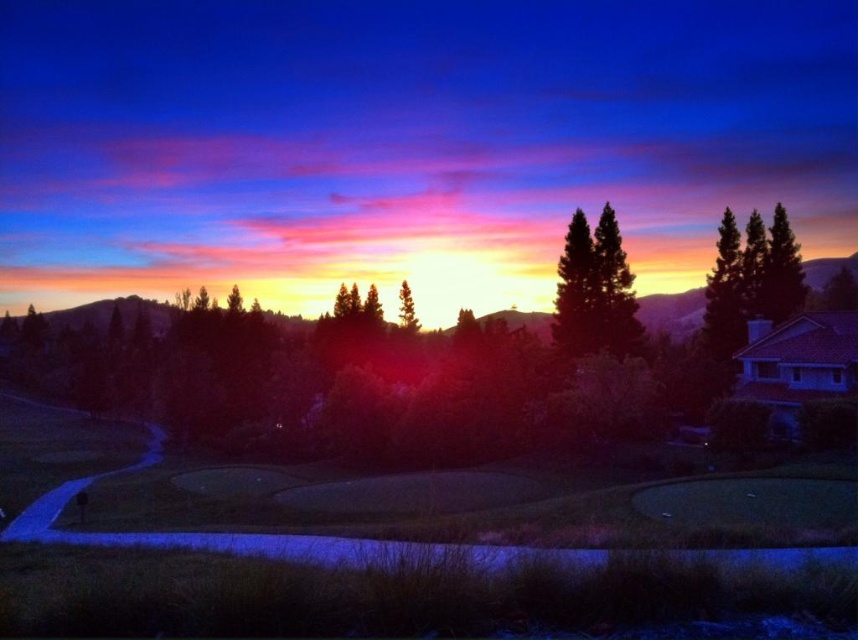
You are standing on the golf course and see both the green matte tree at center and the silvery metallic tree at center. Which tree would appear larger to you?

The green matte tree at center appears larger because it is closer to the viewer than the silvery metallic tree at center.

You are a golfer standing on the fairway and see both the green matte tree at center and the silvery metallic tree at center. Which tree would cast a longer shadow on the ground due to its height?

The green matte tree at center has a greater height compared to the silvery metallic tree at center, so it would cast a longer shadow on the ground.